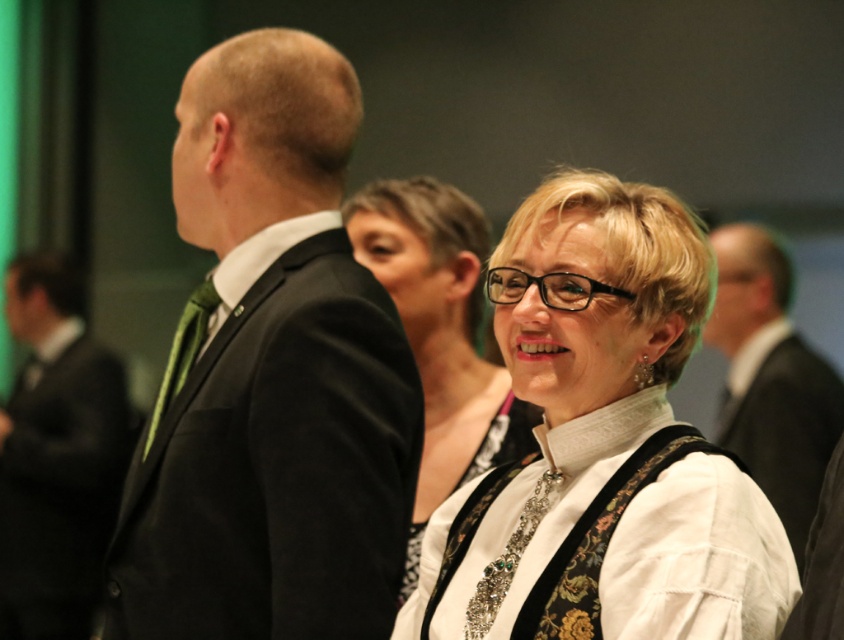
Question: Estimate the real-world distances between objects in this image. Which object is closer to the white lace dress at center?

Choices:
 (A) matte black suit at center
 (B) white lace blouse at center

Answer: (B)

Question: Is white lace blouse at center positioned behind matte black suit at center?

Choices:
 (A) yes
 (B) no

Answer: (B)

Question: Which point is farther to the camera?

Choices:
 (A) black suit at left
 (B) black satin suit at left
 (C) white textured blouse at center
 (D) matte black suit at center

Answer: (A)

Question: Which object is farther from the camera taking this photo?

Choices:
 (A) white textured blouse at center
 (B) matte black suit at center

Answer: (B)

Question: Is white lace blouse at center bigger than matte black suit at center?

Choices:
 (A) no
 (B) yes

Answer: (A)

Question: Does white textured blouse at center have a smaller size compared to white lace dress at center?

Choices:
 (A) yes
 (B) no

Answer: (B)